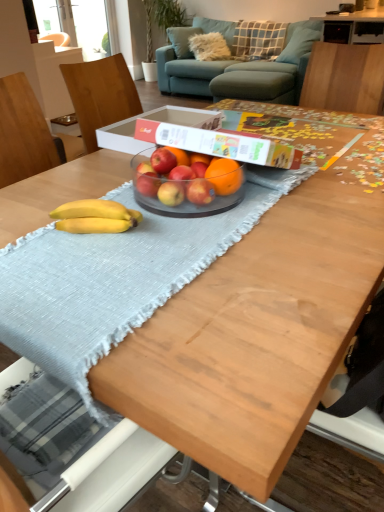
This screenshot has height=512, width=384. What are the coordinates of `free point to the right of yellow matte bananas at center` in the screenshot? It's located at (187, 232).